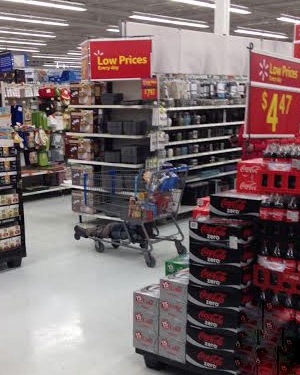
Image resolution: width=300 pixels, height=375 pixels. Identify the location of floor. (73, 320).